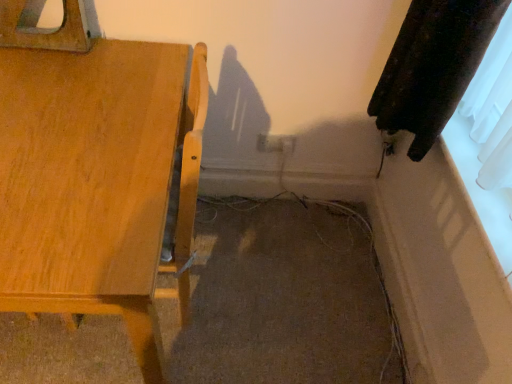
Question: Is the depth of wooden table at left less than that of white plastic electric outlet at center?

Choices:
 (A) no
 (B) yes

Answer: (B)

Question: Does wooden table at left have a lesser height compared to white plastic electric outlet at center?

Choices:
 (A) yes
 (B) no

Answer: (B)

Question: From a real-world perspective, is wooden table at left under white plastic electric outlet at center?

Choices:
 (A) no
 (B) yes

Answer: (A)

Question: From a real-world perspective, is wooden table at left on top of white plastic electric outlet at center?

Choices:
 (A) yes
 (B) no

Answer: (A)

Question: Is wooden table at left thinner than white plastic electric outlet at center?

Choices:
 (A) no
 (B) yes

Answer: (A)

Question: Is wooden table at left at the right side of white plastic electric outlet at center?

Choices:
 (A) yes
 (B) no

Answer: (B)

Question: Is white plastic electric outlet at center located outside wooden table at left?

Choices:
 (A) no
 (B) yes

Answer: (B)

Question: Is white plastic electric outlet at center oriented towards wooden table at left?

Choices:
 (A) no
 (B) yes

Answer: (A)

Question: From a real-world perspective, is white plastic electric outlet at center on wooden table at left?

Choices:
 (A) no
 (B) yes

Answer: (A)

Question: Is white plastic electric outlet at center not near wooden table at left?

Choices:
 (A) no
 (B) yes

Answer: (A)

Question: Can you confirm if white plastic electric outlet at center is positioned to the right of wooden table at left?

Choices:
 (A) yes
 (B) no

Answer: (A)

Question: Is white plastic electric outlet at center closer to the viewer compared to wooden table at left?

Choices:
 (A) yes
 (B) no

Answer: (B)

Question: Looking at the image, does white plastic electric outlet at center seem bigger or smaller compared to wooden table at left?

Choices:
 (A) small
 (B) big

Answer: (A)